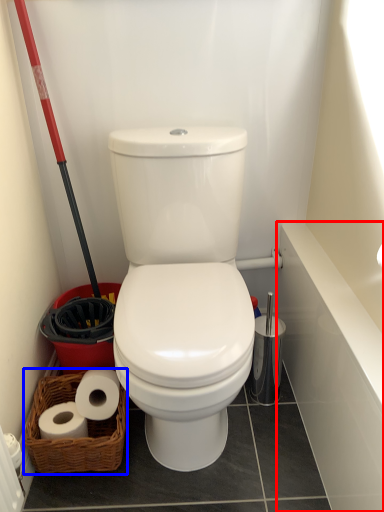
Question: Which object is closer to the camera taking this photo, bath (highlighted by a red box) or basket (highlighted by a blue box)?

Choices:
 (A) bath
 (B) basket

Answer: (A)